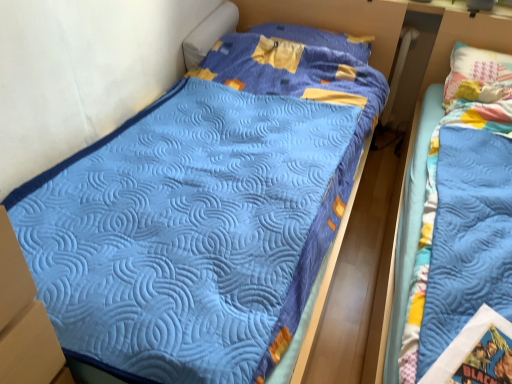
Question: From the image's perspective, relative to blue quilted bed at right, is blue quilted pillow at upper center above or below?

Choices:
 (A) above
 (B) below

Answer: (A)

Question: Looking at their shapes, would you say blue quilted pillow at upper center is wider or thinner than blue quilted bed at right?

Choices:
 (A) wide
 (B) thin

Answer: (B)

Question: Does point (354, 49) appear closer or farther from the camera than point (437, 66)?

Choices:
 (A) closer
 (B) farther

Answer: (A)

Question: Considering their positions, is blue quilted bed at right located in front of or behind blue quilted pillow at upper center?

Choices:
 (A) front
 (B) behind

Answer: (A)

Question: Considering the positions of blue quilted bed at right and blue quilted pillow at upper center in the image, is blue quilted bed at right bigger or smaller than blue quilted pillow at upper center?

Choices:
 (A) big
 (B) small

Answer: (A)

Question: From a real-world perspective, is blue quilted bed at right physically located above or below blue quilted pillow at upper center?

Choices:
 (A) below
 (B) above

Answer: (A)

Question: Is blue quilted bed at right inside or outside of blue quilted pillow at upper center?

Choices:
 (A) outside
 (B) inside

Answer: (A)